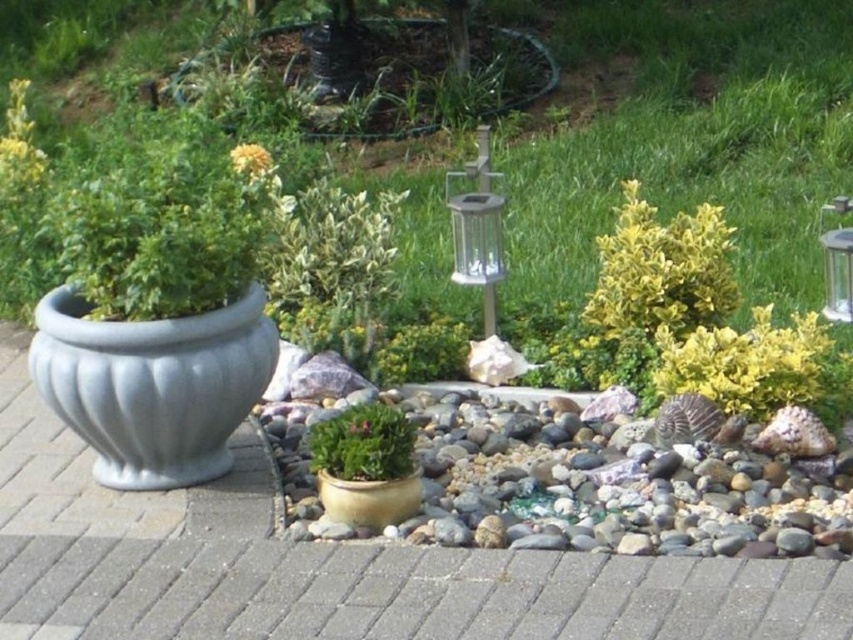
Question: Which object is closer to the camera taking this photo?

Choices:
 (A) yellow matte flower at upper center
 (B) smooth pebbles at center

Answer: (B)

Question: Observing the image, what is the correct spatial positioning of gray matte planter at left in reference to matte yellow pot at center?

Choices:
 (A) below
 (B) above

Answer: (B)

Question: Which point is closer to the camera?

Choices:
 (A) smooth pebbles at center
 (B) gray matte planter at left
 (C) metallic glass lantern at upper right

Answer: (A)

Question: Is green leafy plant at upper left wider than yellow matte flower at upper center?

Choices:
 (A) yes
 (B) no

Answer: (A)

Question: Which point is closer to the camera?

Choices:
 (A) matte yellow pot at center
 (B) green leafy plant at upper left
 (C) matte gold pot at center

Answer: (A)

Question: Can you confirm if gray matte planter at left is thinner than green leafy plant at upper left?

Choices:
 (A) yes
 (B) no

Answer: (B)